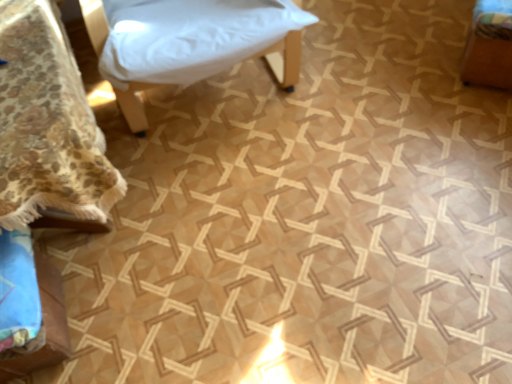
Find the location of a particular element. The width and height of the screenshot is (512, 384). vacant space that's between white fabric cushion at upper center, acting as the third furniture starting from the left, and floral fabric bedspread at lower left, which ranks as the first furniture in left-to-right order is located at coordinates (206, 174).